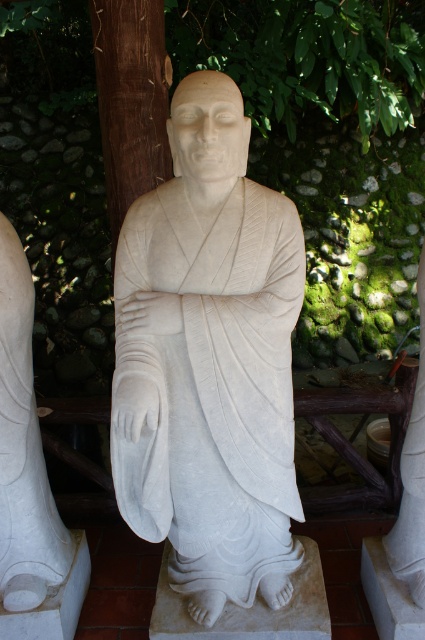
Which of these two, white marble statue at center or white marble statue at lower left, stands taller?

white marble statue at center is taller.

Does point (268, 355) come closer to viewer compared to point (16, 260)?

That is True.

What are the coordinates of `white marble statue at center` in the screenshot? It's located at (209, 362).